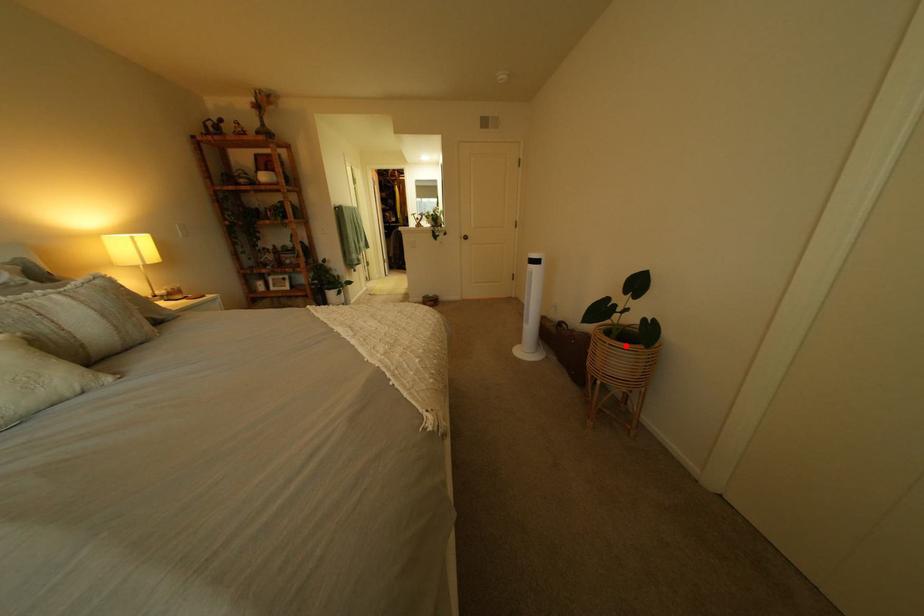
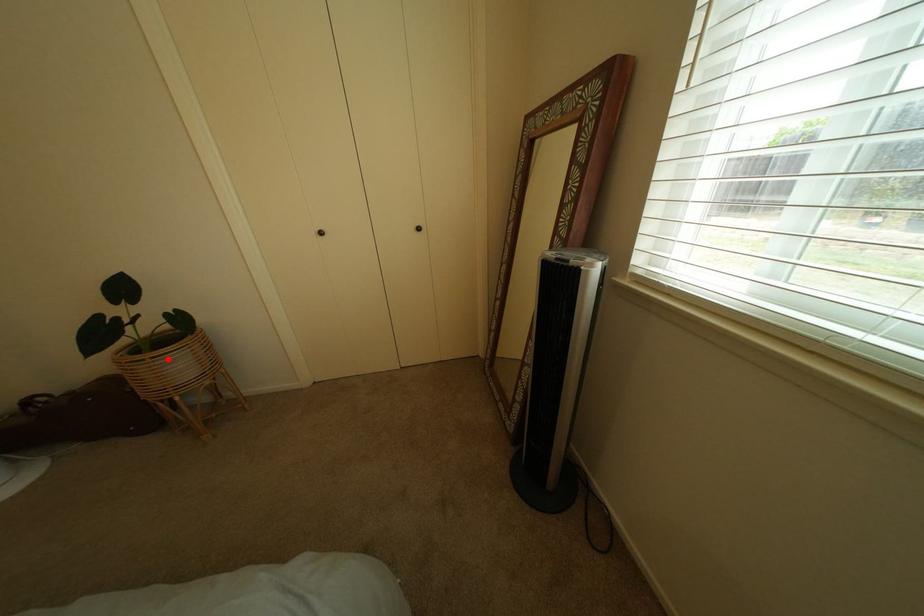
I am providing you with two images of the same scene from different viewpoints. A red point is marked on the first image and another point is marked on the second image. Is the red point in image1 aligned with the point shown in image2?

Yes